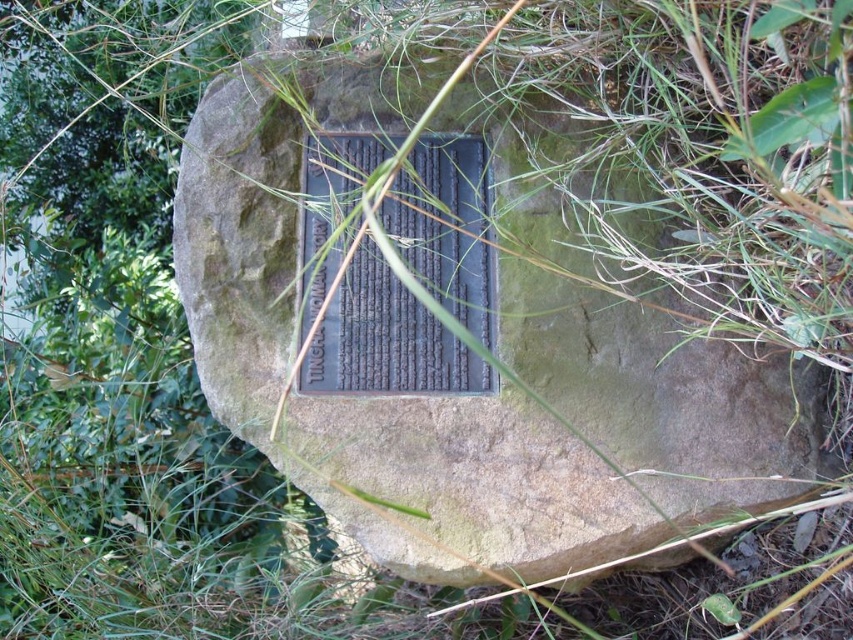
Between point (549, 211) and point (480, 163), which one is positioned in front?

Point (549, 211) is in front.

Is point (775, 429) closer to camera compared to point (366, 362)?

Yes, point (775, 429) is in front of point (366, 362).

I want to click on bronze plaque at center, so click(373, 387).